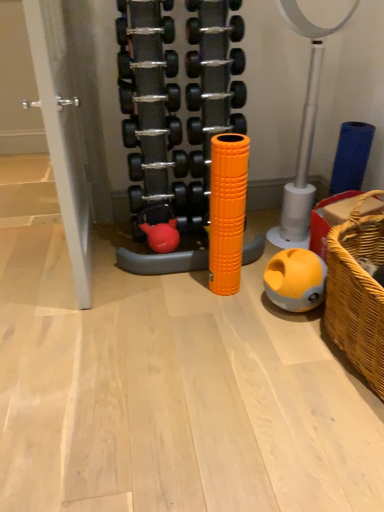
Question: Based on their positions, is yellow matte ball at lower right, the 1th toy ordered from the bottom, located to the left or right of orange rubber foam roller at center, the third toy in the bottom-to-top sequence?

Choices:
 (A) right
 (B) left

Answer: (A)

Question: From a real-world perspective, is yellow matte ball at lower right, the 1th toy ordered from the bottom, physically located above or below orange rubber foam roller at center, the third toy in the bottom-to-top sequence?

Choices:
 (A) below
 (B) above

Answer: (A)

Question: Considering the real-world distances, which object is closest to the woven brown basket at lower right?

Choices:
 (A) yellow matte ball at lower right, the 1th toy ordered from the bottom
 (B) rubberized red dumbbell at center, which ranks as the 2th toy in bottom-to-top order
 (C) orange rubber foam roller at center, the third toy in the bottom-to-top sequence

Answer: (A)

Question: Estimate the real-world distances between objects in this image. Which object is closer to the woven brown basket at lower right?

Choices:
 (A) rubberized red dumbbell at center, which ranks as the 2th toy in bottom-to-top order
 (B) orange rubber foam roller at center, which is the 1th toy in top-to-bottom order
 (C) yellow matte ball at lower right, positioned as the third toy in top-to-bottom order

Answer: (C)